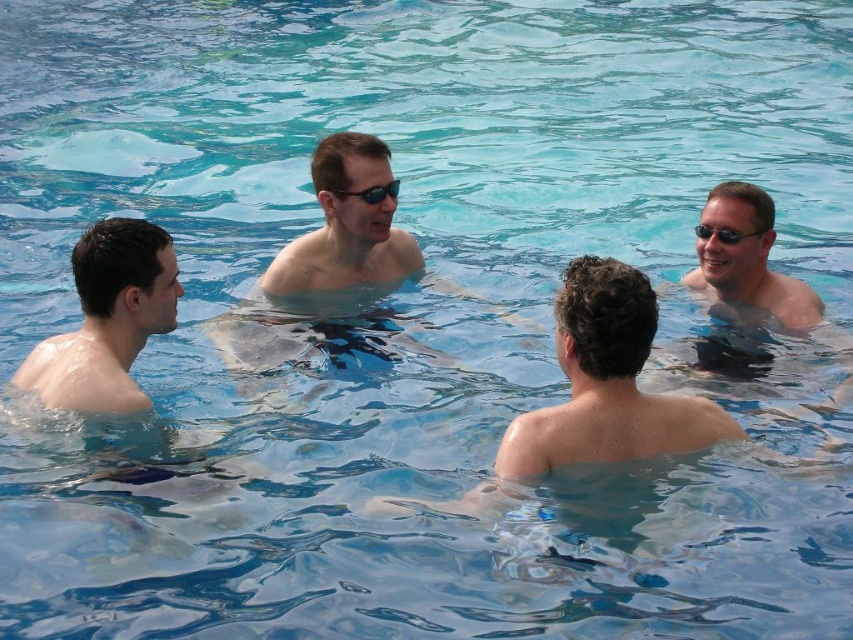
Question: Is smooth skin head at left further to the viewer compared to matte black swim trunks at right?

Choices:
 (A) yes
 (B) no

Answer: (B)

Question: Which object appears farthest from the camera in this image?

Choices:
 (A) matte skin at center
 (B) smooth skin head at left
 (C) matte black sunglasses at upper center

Answer: (A)

Question: Among these points, which one is nearest to the camera?

Choices:
 (A) (270, 272)
 (B) (138, 392)
 (C) (759, 232)
 (D) (395, 188)

Answer: (B)

Question: From the image, what is the correct spatial relationship of matte skin at center in relation to black plastic sunglasses at center?

Choices:
 (A) right
 (B) left

Answer: (B)

Question: Estimate the real-world distances between objects in this image. Which object is closer to the matte skin at center?

Choices:
 (A) matte black swim trunks at right
 (B) black plastic sunglasses at center
 (C) smooth skin head at left

Answer: (B)

Question: Does matte skin at center have a smaller size compared to black plastic sunglasses at center?

Choices:
 (A) yes
 (B) no

Answer: (B)